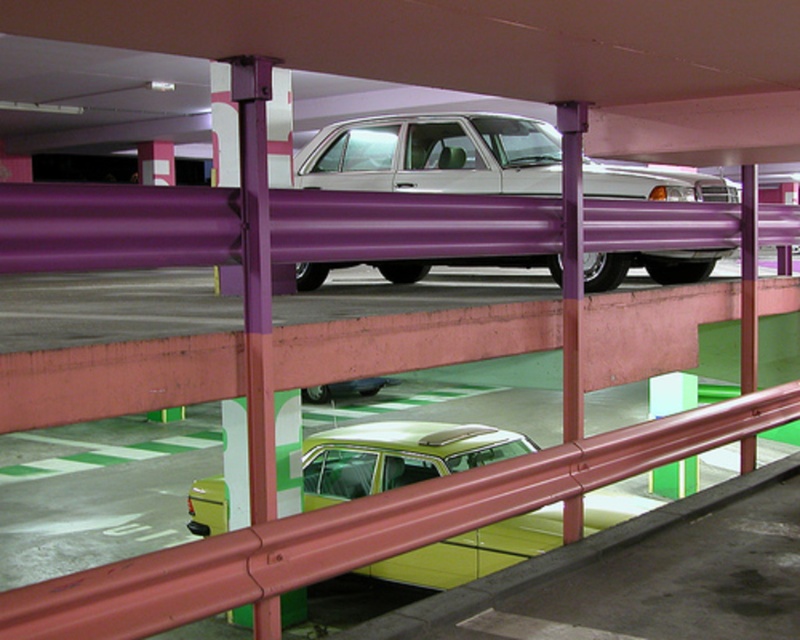
You are standing at the red safety railing in the foreground of the parking garage. You notice two points marked in the scene. The first point is at coordinate point (520, 189) and the second is at point (354, 387). From your current position, which point is closer to you?

Point (520, 189) is in front of point (354, 387), so the first point is closer to you.

You are standing in the parking garage and want to determine the relative positions of two points marked in the scene. Which point is nearer to you, point (332, 452) or point (364, 394)?

Point (332, 452) is closer to the viewer than point (364, 394).

You are standing at the entrance of the parking garage and want to walk to the green matte car at center. There is a silver metallic sedan at center blocking your path. Can you walk around it? Please explain your reasoning.

The silver metallic sedan at center is 9.69 feet away from the green matte car at center. Since the distance between them allows for movement, you can walk around the silver metallic sedan at center to reach the green matte car at center.